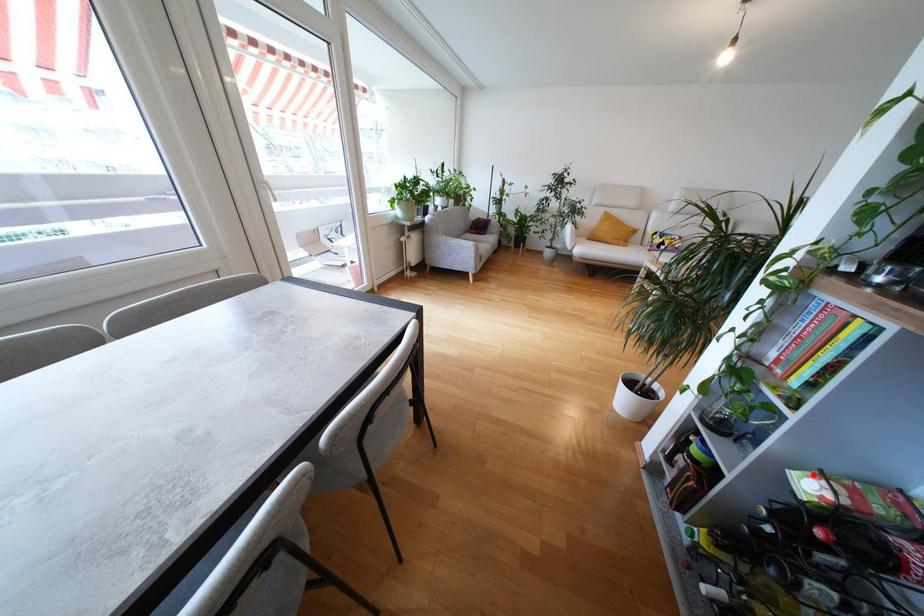
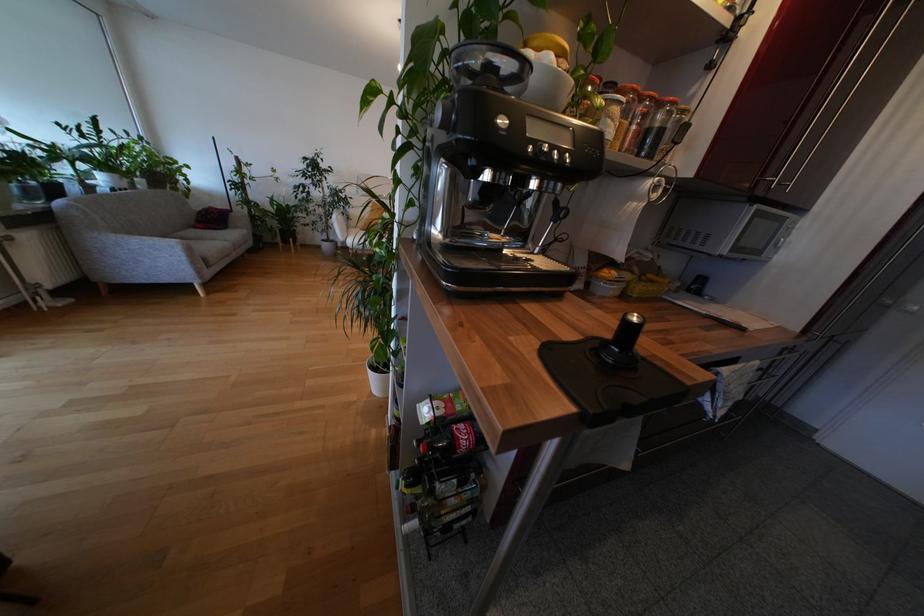
The point at the highlighted location is marked in the first image. Where is the corresponding point in the second image?

(431, 402)